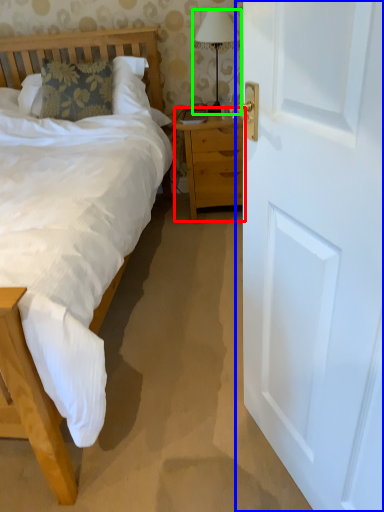
Question: Which is farther away from nightstand (highlighted by a red box)? door (highlighted by a blue box) or bedside lamp (highlighted by a green box)?

Choices:
 (A) door
 (B) bedside lamp

Answer: (A)